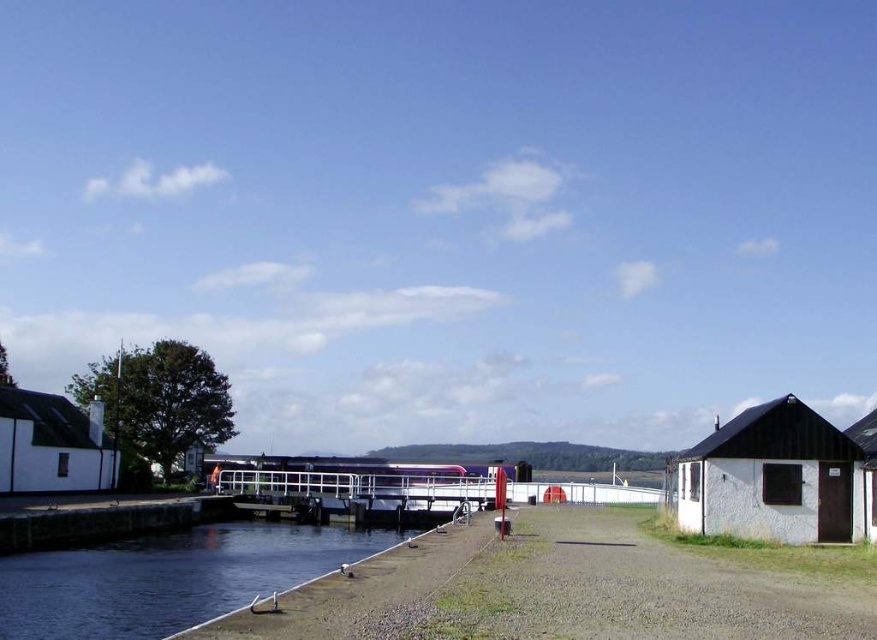
Question: Which point is closer to the camera taking this photo?

Choices:
 (A) (783, 540)
 (B) (20, 406)
 (C) (859, 436)

Answer: (A)

Question: Does white stone hut at lower right appear on the left side of white matte hut at right?

Choices:
 (A) no
 (B) yes

Answer: (B)

Question: Considering the real-world distances, which object is farthest from the white matte hut at left?

Choices:
 (A) white stone hut at lower right
 (B) white matte hut at right
 (C) smooth concrete river at lower left

Answer: (B)

Question: Among these objects, which one is farthest from the camera?

Choices:
 (A) white matte hut at right
 (B) smooth concrete river at lower left
 (C) white stone hut at lower right
 (D) white matte hut at left

Answer: (D)

Question: Does smooth concrete river at lower left appear on the right side of white matte hut at left?

Choices:
 (A) no
 (B) yes

Answer: (B)

Question: Observing the image, what is the correct spatial positioning of white stone hut at lower right in reference to white matte hut at left?

Choices:
 (A) right
 (B) left

Answer: (A)